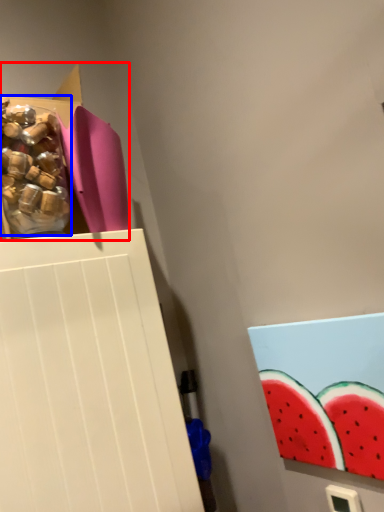
Question: Among these objects, which one is nearest to the camera, storage box (highlighted by a red box) or food (highlighted by a blue box)?

Choices:
 (A) storage box
 (B) food

Answer: (B)